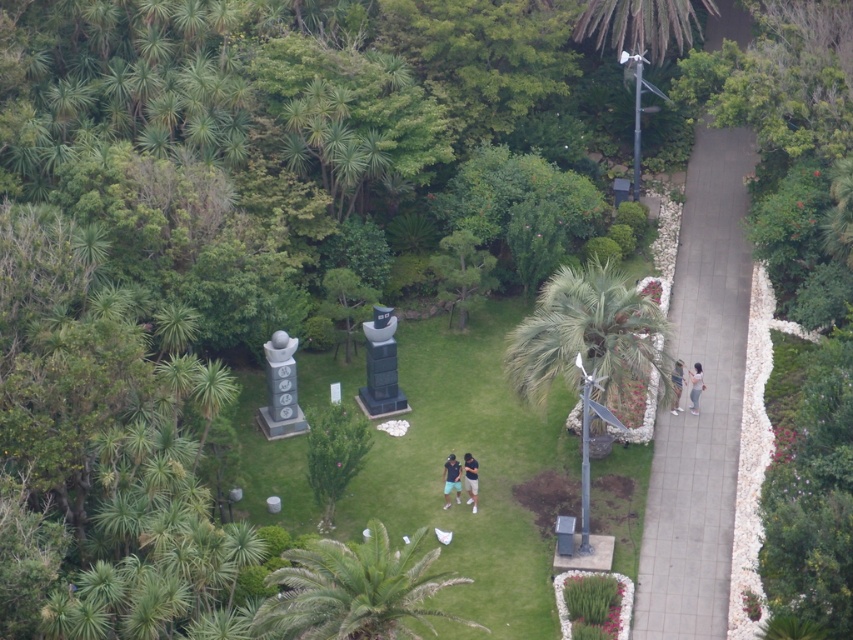
Who is lower down, polished stone statue at center or light brown fabric pants at right?

Positioned lower is light brown fabric pants at right.

Does polished stone statue at center appear on the left side of light brown fabric pants at right?

Yes, polished stone statue at center is to the left of light brown fabric pants at right.

Measure the distance between polished stone statue at center and camera.

A distance of 61.48 meters exists between polished stone statue at center and camera.

The image size is (853, 640). I want to click on polished stone statue at center, so click(x=281, y=388).

Does gray concrete sidewalk at center-right have a lesser height compared to dark blue jeans at center?

No, gray concrete sidewalk at center-right is not shorter than dark blue jeans at center.

Does gray concrete sidewalk at center-right have a smaller size compared to dark blue jeans at center?

Incorrect, gray concrete sidewalk at center-right is not smaller in size than dark blue jeans at center.

Identify the location of gray concrete sidewalk at center-right. Image resolution: width=853 pixels, height=640 pixels. (701, 403).

Locate an element on the screen. Image resolution: width=853 pixels, height=640 pixels. gray concrete sidewalk at center-right is located at coordinates (701, 403).

Can you confirm if blue cotton shirt at center is positioned above dark blue jeans at center?

Correct, blue cotton shirt at center is located above dark blue jeans at center.

Does blue cotton shirt at center have a lesser width compared to dark blue jeans at center?

No.

Where is `blue cotton shirt at center`? The height and width of the screenshot is (640, 853). blue cotton shirt at center is located at coordinates (451, 480).

Where is `blue cotton shirt at center`? This screenshot has width=853, height=640. blue cotton shirt at center is located at coordinates (451, 480).